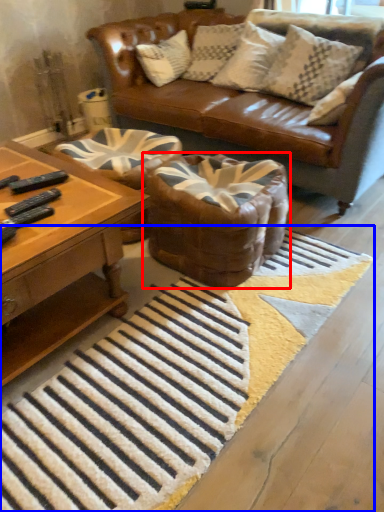
Question: Which of the following is the closest to the observer, swivel chair (highlighted by a red box) or doormat (highlighted by a blue box)?

Choices:
 (A) swivel chair
 (B) doormat

Answer: (B)